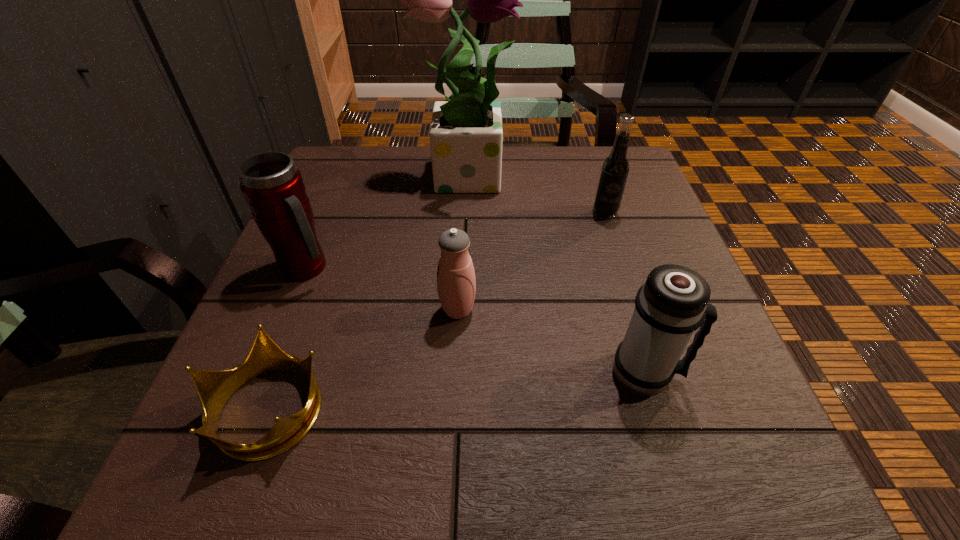
Locate an element on the screen. The height and width of the screenshot is (540, 960). free space that satisfies the following two spatial constraints: 1. on the side with the handle of the leftmost thermos bottle; 2. on the back side of the fourth farthest object is located at coordinates (289, 310).

Image resolution: width=960 pixels, height=540 pixels. I want to click on vacant space that satisfies the following two spatial constraints: 1. on the back side of the second thermos bottle from right to left; 2. on the side with the handle of the leftmost thermos bottle, so click(x=460, y=268).

Locate an element on the screen. This screenshot has height=540, width=960. free space that satisfies the following two spatial constraints: 1. on the side with the handle of the fourth nearest object; 2. on the right side of the second farthest thermos bottle is located at coordinates (289, 310).

Identify the location of vacant space that satisfies the following two spatial constraints: 1. on the side with the handle of the leftmost thermos bottle; 2. on the left side of the crown. The height and width of the screenshot is (540, 960). (250, 408).